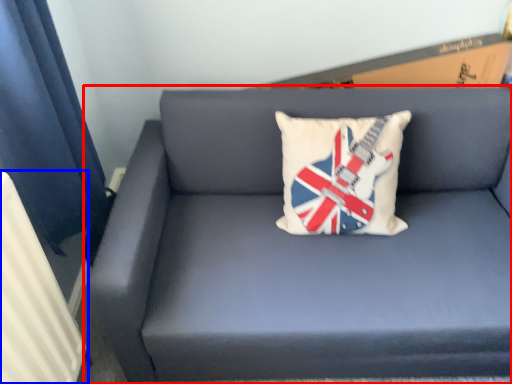
Question: Which object is further to the camera taking this photo, studio couch (highlighted by a red box) or radiator (highlighted by a blue box)?

Choices:
 (A) studio couch
 (B) radiator

Answer: (A)